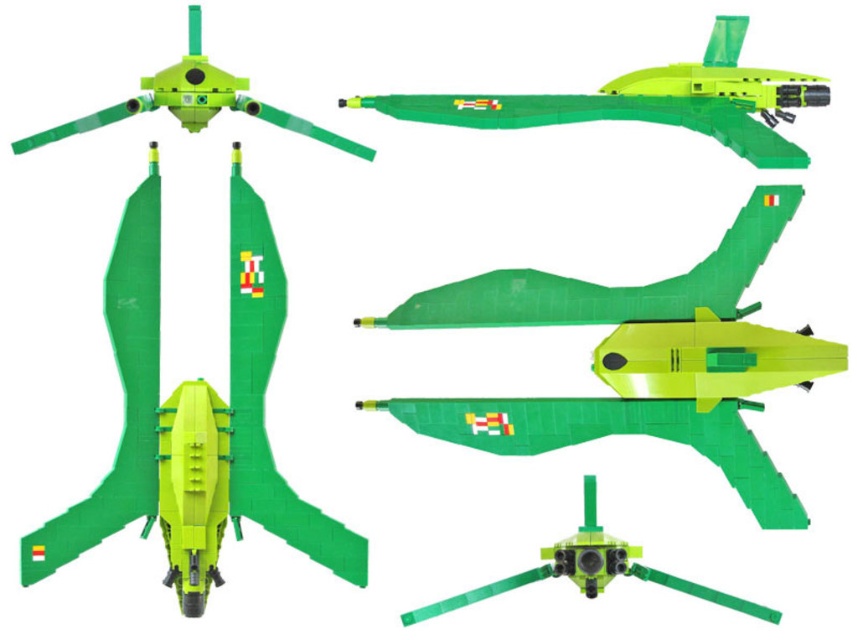
Question: Among these points, which one is nearest to the camera?

Choices:
 (A) (143, 365)
 (B) (593, 589)

Answer: (B)

Question: Does matte plastic drone at upper left appear on the left side of matte green drone at center?

Choices:
 (A) yes
 (B) no

Answer: (A)

Question: Which object is the closest to the matte green plastic helicopter at bottom?

Choices:
 (A) matte plastic drone at upper left
 (B) matte green drone at center

Answer: (A)

Question: Does matte green plastic helicopter at bottom appear on the right side of matte plastic drone at upper left?

Choices:
 (A) no
 (B) yes

Answer: (B)

Question: Among these objects, which one is farthest from the camera?

Choices:
 (A) matte green plastic helicopter at bottom
 (B) matte green drone at center

Answer: (A)

Question: Does matte green plastic helicopter at bottom appear over matte green drone at center?

Choices:
 (A) yes
 (B) no

Answer: (A)